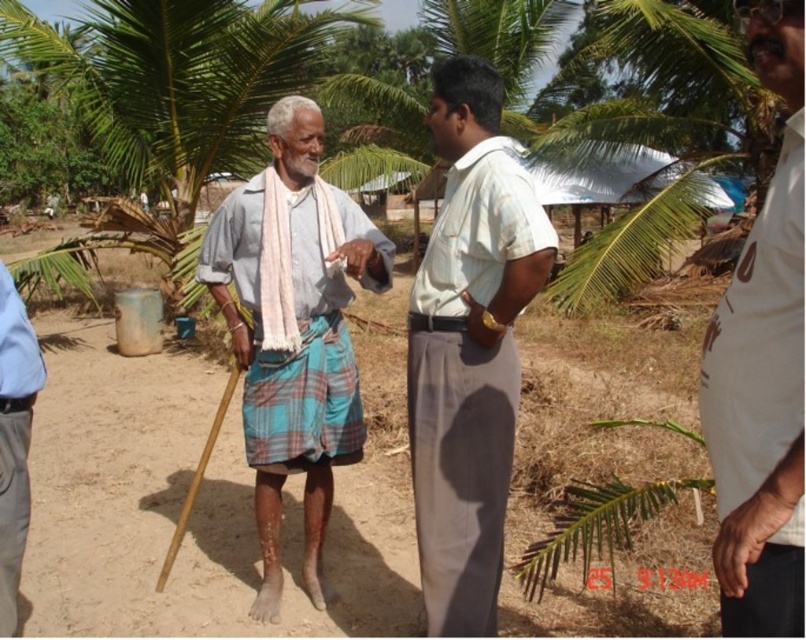
Who is positioned more to the left, white dotted shirt at center or light blue fabric pants at lower left?

Positioned to the left is light blue fabric pants at lower left.

What do you see at coordinates (762, 369) in the screenshot? This screenshot has width=806, height=640. I see `white dotted shirt at center` at bounding box center [762, 369].

In order to click on white dotted shirt at center in this screenshot , I will do `click(762, 369)`.

Consider the image. Is green leafy palm tree at center below blue plaid kilt at center?

No.

Identify the location of green leafy palm tree at center. The image size is (806, 640). (177, 76).

Locate an element on the screen. green leafy palm tree at center is located at coordinates (177, 76).

Which of these two, white smooth shirt at center or light blue fabric pants at lower left, stands taller?

Standing taller between the two is white smooth shirt at center.

Describe the element at coordinates (468, 348) in the screenshot. I see `white smooth shirt at center` at that location.

In order to click on white smooth shirt at center in this screenshot , I will do `click(468, 348)`.